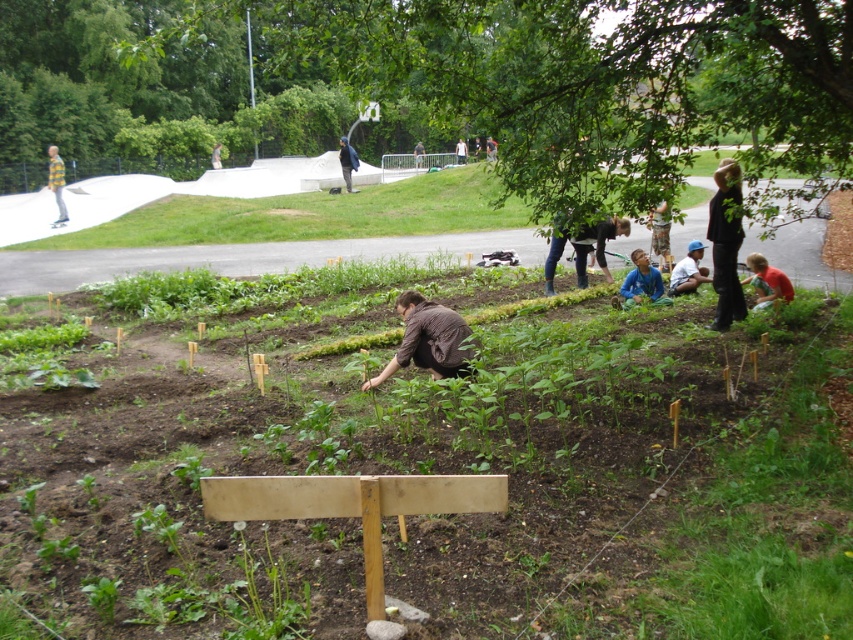
Question: Observing the image, what is the correct spatial positioning of red matte shirt at lower right in reference to wooden figure at center?

Choices:
 (A) right
 (B) left

Answer: (A)

Question: Which is nearer to the wooden figure at center?

Choices:
 (A) blue fabric shirt at center
 (B) dark brown leather jacket at center

Answer: (A)

Question: Is blue shirt at center wider than red matte shirt at lower right?

Choices:
 (A) yes
 (B) no

Answer: (A)

Question: Which point is farther from the camera taking this photo?

Choices:
 (A) (718, 198)
 (B) (421, 163)

Answer: (B)

Question: From the image, what is the correct spatial relationship of wooden figure at center in relation to dark brown leather jacket at center?

Choices:
 (A) left
 (B) right

Answer: (B)

Question: Which of the following is the closest to the observer?

Choices:
 (A) red matte shirt at lower right
 (B) black matte shirt at upper right
 (C) brown leather jacket at center
 (D) blue fabric shirt at center

Answer: (B)